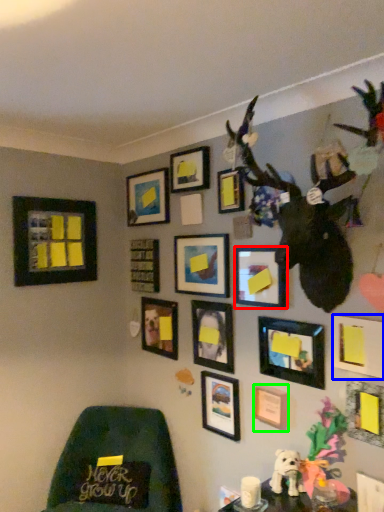
Question: Which is nearer to the picture frame (highlighted by a red box)? picture frame (highlighted by a blue box) or picture frame (highlighted by a green box).

Choices:
 (A) picture frame
 (B) picture frame

Answer: (A)